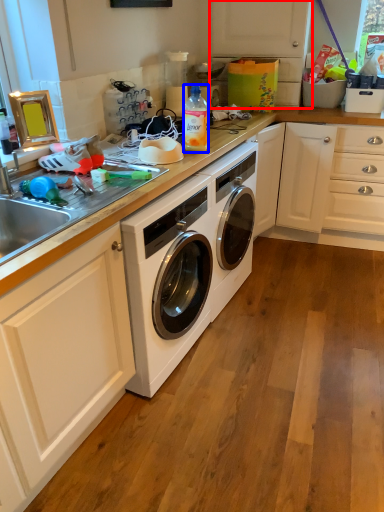
Question: Which object appears closest to the camera in this image, cabinetry (highlighted by a red box) or bottle (highlighted by a blue box)?

Choices:
 (A) cabinetry
 (B) bottle

Answer: (B)